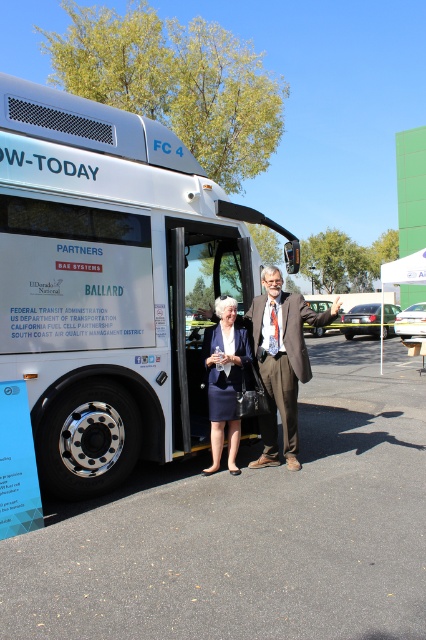
Question: Which point is farther from the camera taking this photo?

Choices:
 (A) (221, 429)
 (B) (241, 576)
 (C) (261, 467)
 (D) (129, 387)

Answer: (C)

Question: Does white metallic bus at center come in front of white plastic bus stop at center?

Choices:
 (A) no
 (B) yes

Answer: (B)

Question: Can you confirm if brown textured suit at center is positioned below navy blue skirt at center?

Choices:
 (A) no
 (B) yes

Answer: (A)

Question: Does white metallic bus at center have a larger size compared to brown textured suit at center?

Choices:
 (A) no
 (B) yes

Answer: (B)

Question: Among these points, which one is nearest to the camera?

Choices:
 (A) (215, 563)
 (B) (379, 321)
 (C) (281, 349)
 (D) (221, 358)

Answer: (A)

Question: Estimate the real-world distances between objects in this image. Which object is closer to the asphalt at lower center?

Choices:
 (A) white metallic bus at center
 (B) white plastic bus stop at center
 (C) navy blue skirt at center

Answer: (C)